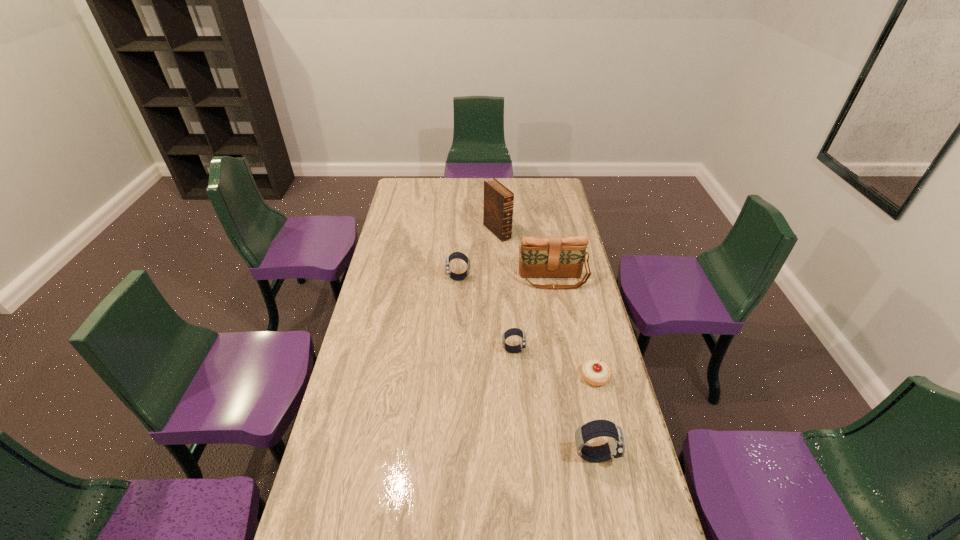
In order to click on pastry located at the right edge in this screenshot , I will do `click(595, 372)`.

In the image, there is a desktop. What are the coordinates of `vacant space at the far edge` in the screenshot? It's located at (525, 178).

The height and width of the screenshot is (540, 960). What are the coordinates of `vacant space at the near edge of the desktop` in the screenshot? It's located at (382, 518).

Image resolution: width=960 pixels, height=540 pixels. What are the coordinates of `vacant region at the left edge of the desktop` in the screenshot? It's located at (386, 327).

In the image, there is a desktop. Where is `blank space at the right edge`? blank space at the right edge is located at coordinates (609, 492).

In the image, there is a desktop. Identify the location of vacant space at the far left corner. This screenshot has height=540, width=960. (415, 195).

Find the location of a particular element. vacant space at the near left corner of the desktop is located at coordinates (345, 535).

At what (x,y) coordinates should I click in order to perform the action: click on vacant space at the near right corner of the desktop. Please return your answer as a coordinate pair (x, y). The height and width of the screenshot is (540, 960). Looking at the image, I should click on (631, 531).

I want to click on empty location between the second tallest watch and the fifth farthest object, so click(x=526, y=328).

Find the location of a particular element. This screenshot has width=960, height=540. vacant area that lies between the shoulder bag and the nearest object is located at coordinates (573, 367).